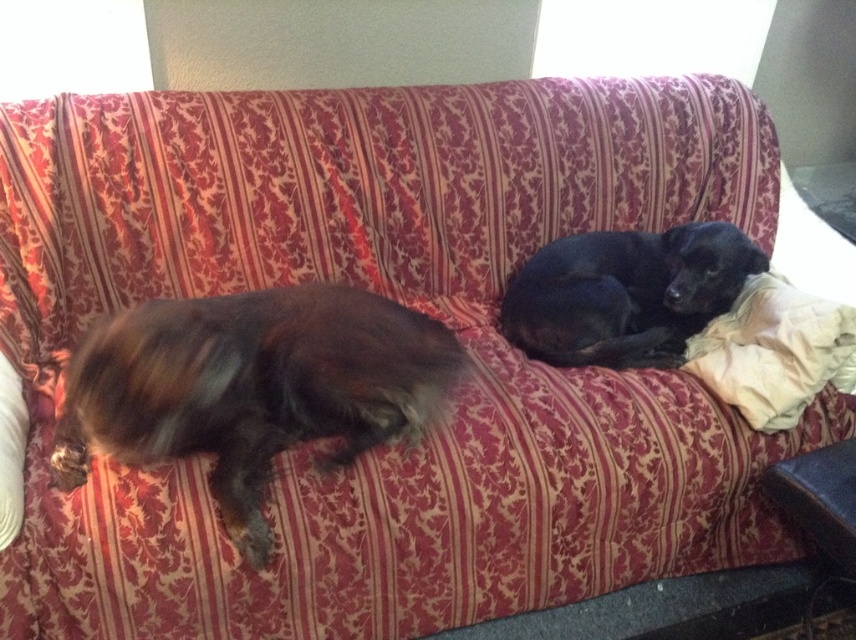
Can you confirm if black smooth dog at right is positioned below white cotton pillow at right?

Incorrect, black smooth dog at right is not positioned below white cotton pillow at right.

Is black smooth dog at right closer to camera compared to white cotton pillow at right?

No.

Is point (642, 250) positioned before point (801, 312)?

No.

Image resolution: width=856 pixels, height=640 pixels. Identify the location of black smooth dog at right. (625, 292).

Who is taller, brown fuzzy dog at left or white cotton pillow at right?

With more height is brown fuzzy dog at left.

In order to click on brown fuzzy dog at left in this screenshot , I will do `click(250, 387)`.

Is point (132, 422) farther from camera compared to point (794, 384)?

No, (132, 422) is closer to viewer.

The width and height of the screenshot is (856, 640). Find the location of `brown fuzzy dog at left`. brown fuzzy dog at left is located at coordinates click(x=250, y=387).

Can you confirm if brown fuzzy dog at left is positioned above black smooth dog at right?

Actually, brown fuzzy dog at left is below black smooth dog at right.

Does brown fuzzy dog at left have a lesser height compared to black smooth dog at right?

Incorrect, brown fuzzy dog at left's height does not fall short of black smooth dog at right's.

Locate an element on the screen. brown fuzzy dog at left is located at coordinates (250, 387).